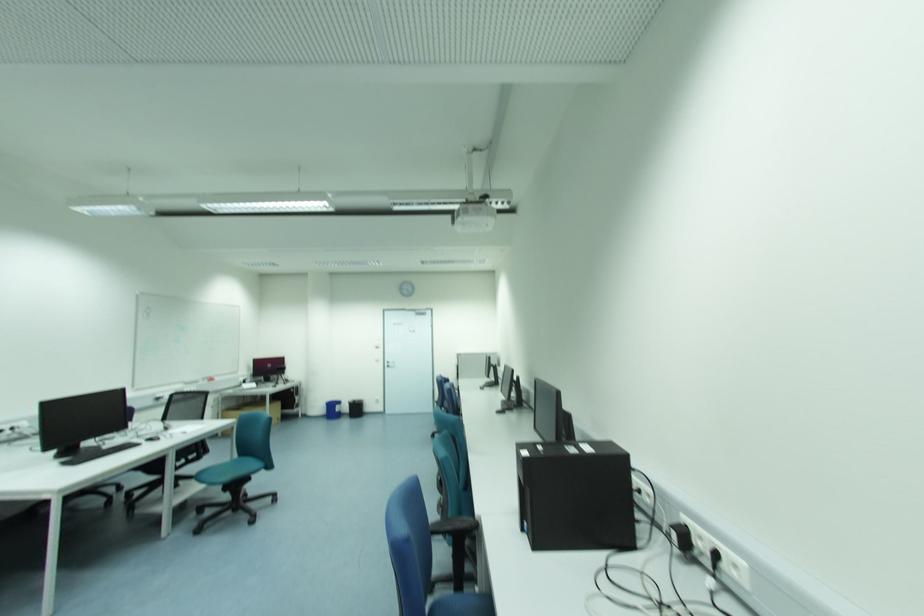
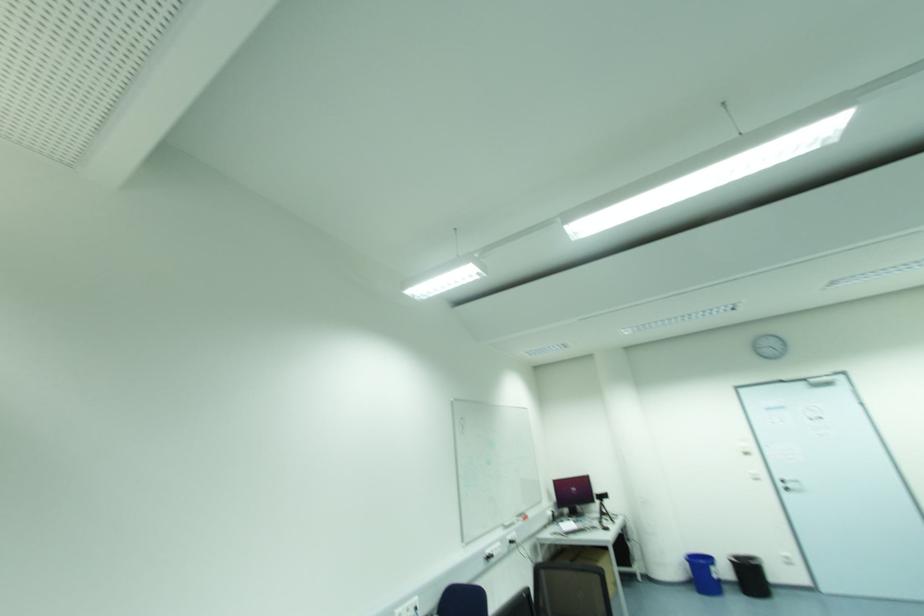
In the second image, find the point that corresponds to point (391, 365) in the first image.

(789, 485)